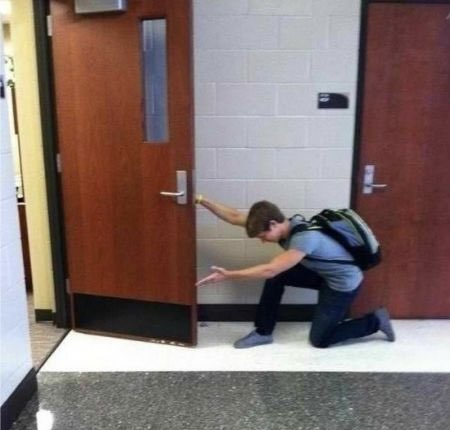
Locate an element on the screen. The image size is (450, 430). room interior is located at coordinates (14, 118).